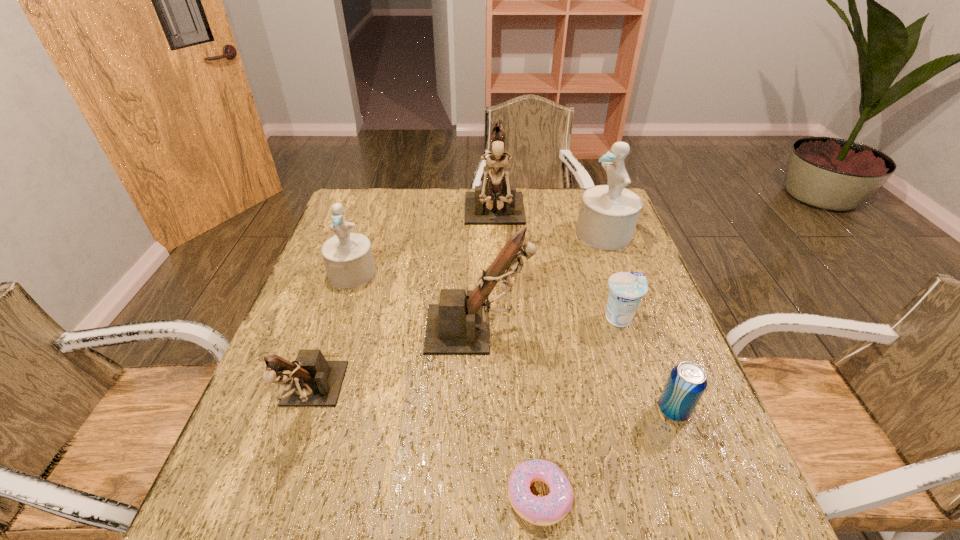
Where is `free space between the farthest brown figurine and the third nearest figurine`? Image resolution: width=960 pixels, height=540 pixels. free space between the farthest brown figurine and the third nearest figurine is located at coordinates (423, 246).

Identify the location of the third closest object to the biggest brown figurine. (459, 325).

Identify the location of object that stands as the third closest to the bigger white figurine. (459, 325).

Locate which figurine is the closest to the bigger white figurine. Please provide its 2D coordinates. Your answer should be formatted as a tuple, i.e. [(x, y)], where the tuple contains the x and y coordinates of a point satisfying the conditions above.

[(495, 202)]

The height and width of the screenshot is (540, 960). Identify the location of figurine identified as the second closest to the biggest brown figurine. (348, 259).

Choose which brown figurine is the second nearest neighbor to the nearest figurine. Please provide its 2D coordinates. Your answer should be formatted as a tuple, i.e. [(x, y)], where the tuple contains the x and y coordinates of a point satisfying the conditions above.

[(495, 202)]

Locate which brown figurine ranks in proximity to the smallest brown figurine. Please provide its 2D coordinates. Your answer should be formatted as a tuple, i.e. [(x, y)], where the tuple contains the x and y coordinates of a point satisfying the conditions above.

[(459, 325)]

The width and height of the screenshot is (960, 540). I want to click on vacant space that satisfies the following two spatial constraints: 1. on the front-facing side of the second smallest brown figurine; 2. on the front-facing side of the nearest figurine, so click(477, 398).

I want to click on vacant space that satisfies the following two spatial constraints: 1. on the front-facing side of the blue beer can; 2. on the left side of the biggest brown figurine, so click(503, 410).

Locate an element on the screen. free location that satisfies the following two spatial constraints: 1. on the front-facing side of the biggest brown figurine; 2. on the front-facing side of the second farthest brown figurine is located at coordinates (500, 329).